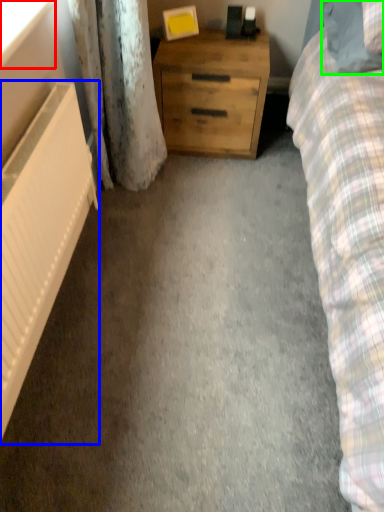
Question: Based on their relative distances, which object is farther from window screen (highlighted by a red box)? Choose from radiator (highlighted by a blue box) and pillow (highlighted by a green box).

Choices:
 (A) radiator
 (B) pillow

Answer: (B)